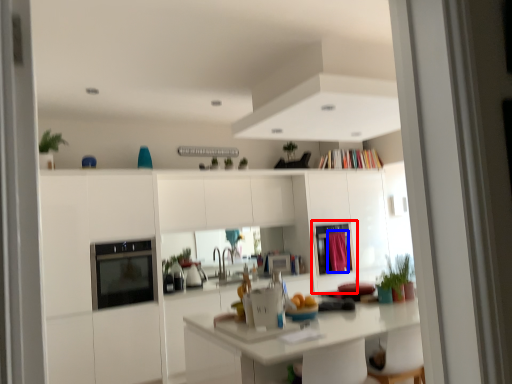
Question: Which point is closer to the camera, screen door (highlighted by a red box) or curtain (highlighted by a blue box)?

Choices:
 (A) screen door
 (B) curtain

Answer: (A)